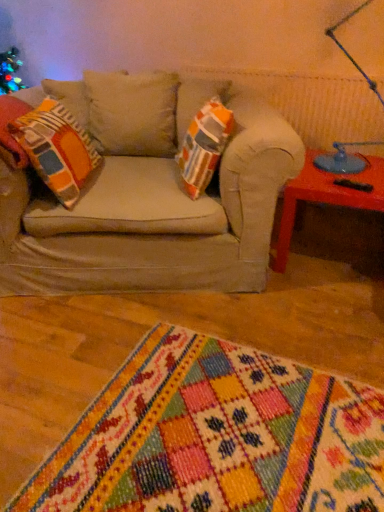
The image size is (384, 512). What do you see at coordinates (56, 149) in the screenshot?
I see `orange and gray striped pillow at left` at bounding box center [56, 149].

This screenshot has height=512, width=384. I want to click on blue glass table lamp at upper right, so click(x=343, y=159).

Based on the photo, considering their positions, is blue glass table lamp at upper right located in front of or behind multicolored woven rug at lower center?

Clearly, blue glass table lamp at upper right is behind multicolored woven rug at lower center.

Find the location of a particular element. This screenshot has height=512, width=384. blanket in front of the blue glass table lamp at upper right is located at coordinates (216, 437).

Is blue glass table lamp at upper right situated inside multicolored woven rug at lower center or outside?

blue glass table lamp at upper right is outside multicolored woven rug at lower center.

From a real-world perspective, relative to multicolored woven rug at lower center, is blue glass table lamp at upper right vertically above or below?

blue glass table lamp at upper right is situated higher than multicolored woven rug at lower center in the real world.

Locate an element on the screen. This screenshot has height=512, width=384. throw pillow in front of the matte orange table at right is located at coordinates pyautogui.click(x=56, y=149).

Considering the positions of objects orange and gray striped pillow at left and matte orange table at right in the image provided, who is more to the left, orange and gray striped pillow at left or matte orange table at right?

orange and gray striped pillow at left.

Would you say orange and gray striped pillow at left is outside matte orange table at right?

Yes, orange and gray striped pillow at left is not within matte orange table at right.

From a real-world perspective, does orange and gray striped pillow at left stand above blue glass table lamp at upper right?

Incorrect, from a real-world perspective, orange and gray striped pillow at left is lower than blue glass table lamp at upper right.

Which is behind, orange and gray striped pillow at left or blue glass table lamp at upper right?

blue glass table lamp at upper right is further from the camera.

Which point is more forward, (380, 182) or (135, 451)?

The point (135, 451) is closer to the camera.

Identify the location of table on the right of multicolored woven rug at lower center. The width and height of the screenshot is (384, 512). coord(325,198).

Does matte orange table at right have a smaller size compared to multicolored woven rug at lower center?

Correct, matte orange table at right occupies less space than multicolored woven rug at lower center.

Looking at their sizes, would you say orange and gray striped pillow at left is wider or thinner than multicolored woven rug at lower center?

Clearly, orange and gray striped pillow at left has less width compared to multicolored woven rug at lower center.

Consider the image. Is multicolored woven rug at lower center a part of orange and gray striped pillow at left?

That's incorrect, multicolored woven rug at lower center is not inside orange and gray striped pillow at left.

Locate an element on the screen. blanket below the orange and gray striped pillow at left (from a real-world perspective) is located at coordinates (216, 437).

Looking at this image, can you confirm if orange and gray striped pillow at left is smaller than multicolored woven rug at lower center?

Indeed, orange and gray striped pillow at left has a smaller size compared to multicolored woven rug at lower center.

Does blue glass table lamp at upper right turn towards orange and gray striped pillow at left?

No, blue glass table lamp at upper right does not turn towards orange and gray striped pillow at left.

Can you confirm if blue glass table lamp at upper right is taller than orange and gray striped pillow at left?

Yes, blue glass table lamp at upper right is taller than orange and gray striped pillow at left.

From the picture: Considering the relative sizes of blue glass table lamp at upper right and orange and gray striped pillow at left in the image provided, is blue glass table lamp at upper right thinner than orange and gray striped pillow at left?

Yes.

From the image's perspective, is blue glass table lamp at upper right on top of orange and gray striped pillow at left?

Correct, blue glass table lamp at upper right appears higher than orange and gray striped pillow at left in the image.

Is orange and gray striped pillow at left inside multicolored woven rug at lower center?

No.

In the scene shown: Which is more to the right, multicolored woven rug at lower center or orange and gray striped pillow at left?

Positioned to the right is multicolored woven rug at lower center.

Considering the sizes of objects multicolored woven rug at lower center and orange and gray striped pillow at left in the image provided, who is smaller, multicolored woven rug at lower center or orange and gray striped pillow at left?

orange and gray striped pillow at left.

Which point is more forward, (136, 490) or (46, 119)?

The point (136, 490) is closer.

At what (x,y) coordinates should I click in order to perform the action: click on table lamp above the multicolored woven rug at lower center (from a real-world perspective). Please return your answer as a coordinate pair (x, y). Looking at the image, I should click on (343, 159).

Where is `table that appears behind the orange and gray striped pillow at left`? Image resolution: width=384 pixels, height=512 pixels. table that appears behind the orange and gray striped pillow at left is located at coordinates (325, 198).

From the image, which object appears to be farther from blue glass table lamp at upper right, orange and gray striped pillow at left or multicolored woven rug at lower center?

Based on the image, multicolored woven rug at lower center appears to be further to blue glass table lamp at upper right.

Considering their positions, is blue glass table lamp at upper right positioned closer to multicolored woven rug at lower center than matte orange table at right?

Based on the image, matte orange table at right appears to be nearer to multicolored woven rug at lower center.

Consider the image. Estimate the real-world distances between objects in this image. Which object is closer to multicolored woven rug at lower center, orange and gray striped pillow at left or matte orange table at right?

matte orange table at right.

From the picture: From the image, which object appears to be farther from multicolored woven rug at lower center, orange and gray striped pillow at left or blue glass table lamp at upper right?

blue glass table lamp at upper right is further to multicolored woven rug at lower center.

Based on their spatial positions, is matte orange table at right or orange and gray striped pillow at left closer to blue glass table lamp at upper right?

matte orange table at right is closer to blue glass table lamp at upper right.

Looking at the image, which one is located further to matte orange table at right, orange and gray striped pillow at left or blue glass table lamp at upper right?

Among the two, orange and gray striped pillow at left is located further to matte orange table at right.

Looking at the image, which one is located further to matte orange table at right, blue glass table lamp at upper right or orange and gray striped pillow at left?

orange and gray striped pillow at left.

Looking at this image, based on their spatial positions, is blue glass table lamp at upper right or multicolored woven rug at lower center closer to orange and gray striped pillow at left?

Among the two, multicolored woven rug at lower center is located nearer to orange and gray striped pillow at left.

You are a GUI agent. You are given a task and a screenshot of the screen. Output one action in this format:
    pyautogui.click(x=<x>, y=<y>)
    Task: Click on the table lamp situated between multicolored woven rug at lower center and matte orange table at right from left to right
    
    Given the screenshot: What is the action you would take?
    click(x=343, y=159)

Locate an element on the screen. blanket situated between orange and gray striped pillow at left and blue glass table lamp at upper right from left to right is located at coordinates (216, 437).

Locate an element on the screen. Image resolution: width=384 pixels, height=512 pixels. blanket situated between orange and gray striped pillow at left and matte orange table at right from left to right is located at coordinates (216, 437).

I want to click on table lamp situated between orange and gray striped pillow at left and matte orange table at right from left to right, so click(x=343, y=159).